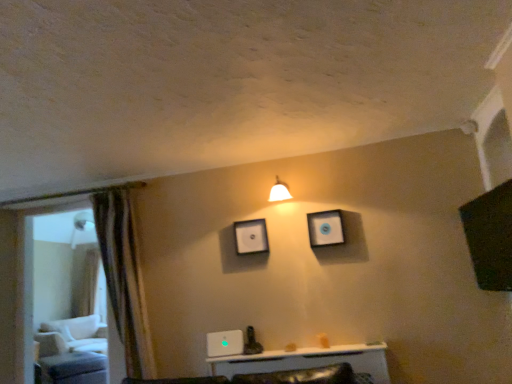
Question: Considering the relative positions of white fabric swivel chair at left and transparent glass door at left in the image provided, is white fabric swivel chair at left to the right of transparent glass door at left from the viewer's perspective?

Choices:
 (A) no
 (B) yes

Answer: (A)

Question: From the image's perspective, is white fabric swivel chair at left under transparent glass door at left?

Choices:
 (A) yes
 (B) no

Answer: (A)

Question: Considering the relative sizes of white fabric swivel chair at left and transparent glass door at left in the image provided, is white fabric swivel chair at left taller than transparent glass door at left?

Choices:
 (A) yes
 (B) no

Answer: (B)

Question: From a real-world perspective, is white fabric swivel chair at left on transparent glass door at left?

Choices:
 (A) no
 (B) yes

Answer: (A)

Question: Is white fabric swivel chair at left to the left of transparent glass door at left from the viewer's perspective?

Choices:
 (A) no
 (B) yes

Answer: (B)

Question: Does white fabric swivel chair at left have a greater width compared to transparent glass door at left?

Choices:
 (A) no
 (B) yes

Answer: (B)

Question: Considering the relative sizes of matte white picture frame at upper center, the 1th picture frame viewed from the front, and white glossy light fixture at upper center in the image provided, is matte white picture frame at upper center, the 1th picture frame viewed from the front, shorter than white glossy light fixture at upper center?

Choices:
 (A) yes
 (B) no

Answer: (B)

Question: Considering the relative sizes of matte white picture frame at upper center, which is counted as the first picture frame, starting from the right, and white glossy light fixture at upper center in the image provided, is matte white picture frame at upper center, which is counted as the first picture frame, starting from the right, smaller than white glossy light fixture at upper center?

Choices:
 (A) no
 (B) yes

Answer: (B)

Question: Does matte white picture frame at upper center, arranged as the second picture frame when viewed from the left, have a larger size compared to white glossy light fixture at upper center?

Choices:
 (A) no
 (B) yes

Answer: (A)

Question: Considering the relative sizes of matte white picture frame at upper center, which is counted as the first picture frame, starting from the right, and white glossy light fixture at upper center in the image provided, is matte white picture frame at upper center, which is counted as the first picture frame, starting from the right, wider than white glossy light fixture at upper center?

Choices:
 (A) no
 (B) yes

Answer: (A)

Question: Is white glossy light fixture at upper center inside matte white picture frame at upper center, which is counted as the second picture frame, starting from the back?

Choices:
 (A) no
 (B) yes

Answer: (A)

Question: Is matte white picture frame at upper center, which is counted as the first picture frame, starting from the right, to the left of white glossy light fixture at upper center from the viewer's perspective?

Choices:
 (A) yes
 (B) no

Answer: (B)

Question: From the image's perspective, is white glossy light fixture at upper center located above matte white picture frame at upper center, the 1th picture frame viewed from the front?

Choices:
 (A) yes
 (B) no

Answer: (A)